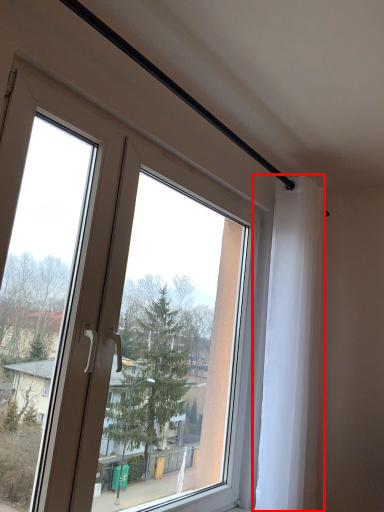
Question: Considering the relative positions of curtain (annotated by the red box) and window in the image provided, where is curtain (annotated by the red box) located with respect to the staircase?

Choices:
 (A) right
 (B) left

Answer: (A)